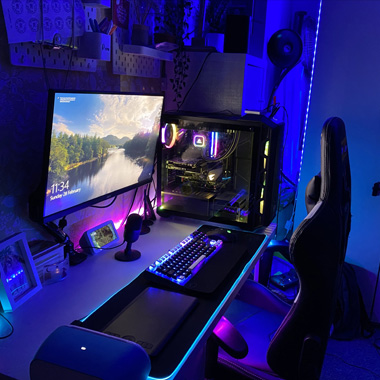
Where is `the top right corner of photo frame`? The image size is (380, 380). the top right corner of photo frame is located at coordinates (22, 237).